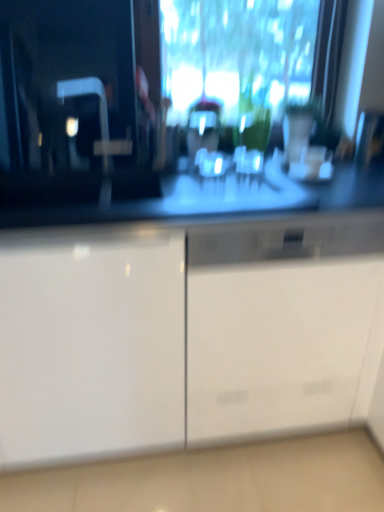
Question: Considering the relative sizes of white glossy cabinet at left and white glossy cabinet at center in the image provided, is white glossy cabinet at left taller than white glossy cabinet at center?

Choices:
 (A) no
 (B) yes

Answer: (B)

Question: Would you say white glossy cabinet at left is a long distance from white glossy cabinet at center?

Choices:
 (A) no
 (B) yes

Answer: (A)

Question: Can you confirm if white glossy cabinet at left is smaller than white glossy cabinet at center?

Choices:
 (A) no
 (B) yes

Answer: (A)

Question: Is white glossy cabinet at left facing towards white glossy cabinet at center?

Choices:
 (A) no
 (B) yes

Answer: (A)

Question: Does white glossy cabinet at left appear on the right side of white glossy cabinet at center?

Choices:
 (A) yes
 (B) no

Answer: (B)

Question: Considering the relative positions of white glossy cabinet at left and white glossy cabinet at center in the image provided, is white glossy cabinet at left to the left of white glossy cabinet at center from the viewer's perspective?

Choices:
 (A) no
 (B) yes

Answer: (B)

Question: Is white glossy cabinet at center in contact with white glossy cabinet at left?

Choices:
 (A) no
 (B) yes

Answer: (A)

Question: From a real-world perspective, is white glossy cabinet at center positioned over white glossy cabinet at left based on gravity?

Choices:
 (A) no
 (B) yes

Answer: (A)

Question: Is white glossy cabinet at center further to camera compared to white glossy cabinet at left?

Choices:
 (A) no
 (B) yes

Answer: (B)

Question: From a real-world perspective, is white glossy cabinet at center positioned under white glossy cabinet at left based on gravity?

Choices:
 (A) yes
 (B) no

Answer: (A)

Question: From the image's perspective, is white glossy cabinet at center over white glossy cabinet at left?

Choices:
 (A) yes
 (B) no

Answer: (B)

Question: Would you consider white glossy cabinet at center to be distant from white glossy cabinet at left?

Choices:
 (A) no
 (B) yes

Answer: (A)

Question: Considering the positions of white glossy cabinet at center and white glossy cabinet at left in the image, is white glossy cabinet at center bigger or smaller than white glossy cabinet at left?

Choices:
 (A) big
 (B) small

Answer: (B)